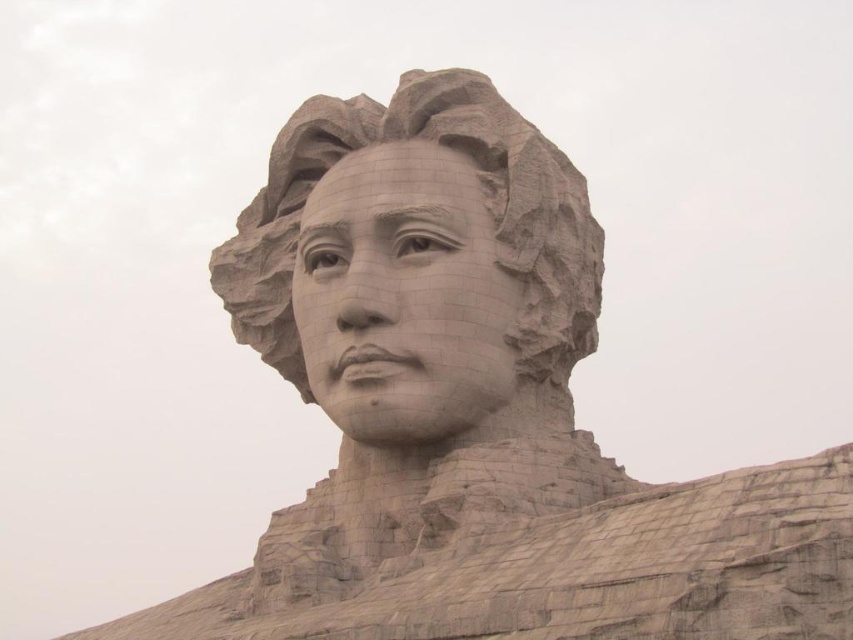
You are an art conservator examining the sculpture. You notice that the matte stone face at center has a different texture from the gray stone sculpture at center. Based on their spatial relationship, which part is more likely to be the original surface of the sculpture?

The matte stone face at center is in front of the gray stone sculpture at center, which suggests that the matte stone face is a later addition or restoration, making the gray stone sculpture at center more likely to be the original surface.

You are standing at the base of the matte stone face at center. Your friend is standing 83.70 meters away from you. If you both walk towards each other at a combined speed of 3 meters per second, how long will it take for you to meet?

The distance between you and your friend is 83.70 meters. At a combined speed of 3 meters per second, it will take 27.9 seconds to meet.